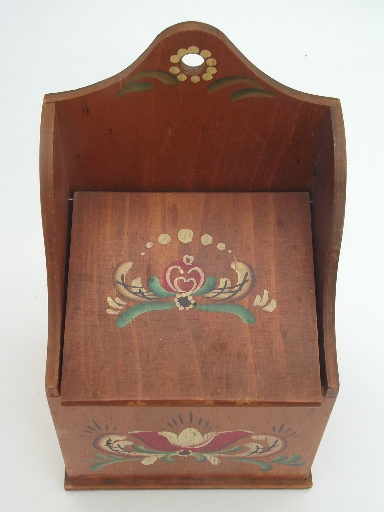
The height and width of the screenshot is (512, 384). In order to click on trim edge in this screenshot , I will do `click(249, 485)`.